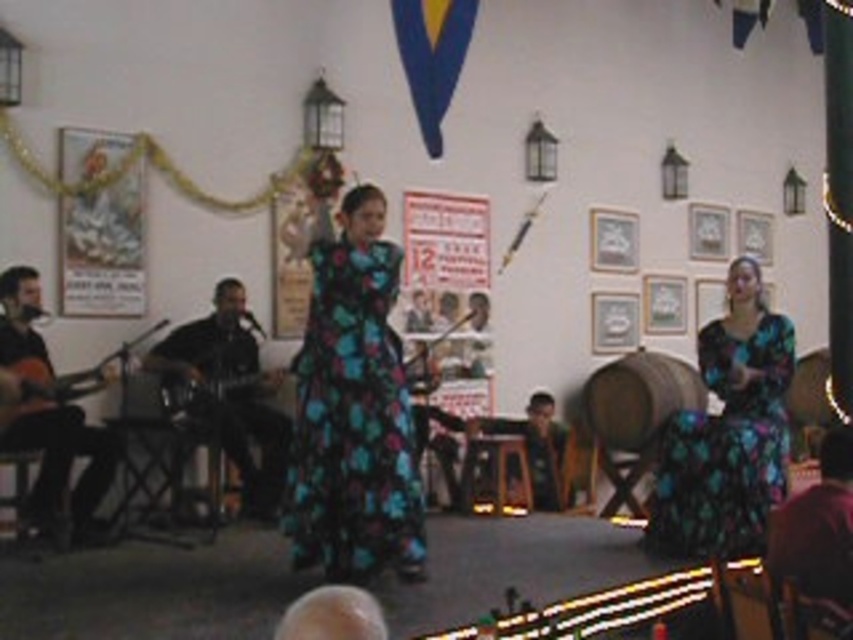
You are a photographer setting up for a flamenco performance. You need to place a microphone exactly at point (x=50, y=410). What object is located at that point?

The point (x=50, y=410) corresponds to the matte brown guitar at left.

You are a photographer setting up for a flamenco performance. You see the dark brown leather guitar at left and the metallic electric guitar at left. Which guitar is positioned more to the right side from your perspective?

The dark brown leather guitar at left is positioned more to the right side from your perspective compared to the metallic electric guitar at left.